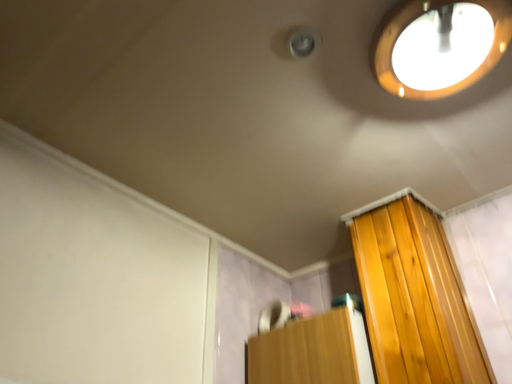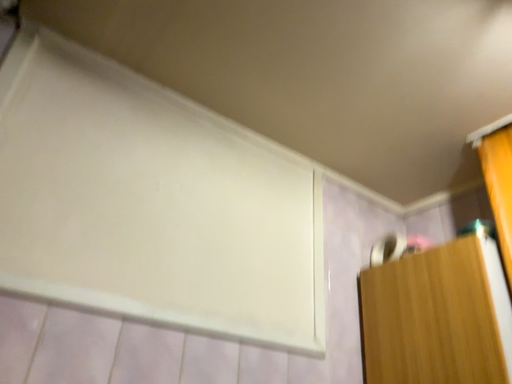
Question: Which way did the camera rotate in the video?

Choices:
 (A) rotated left
 (B) rotated right

Answer: (A)